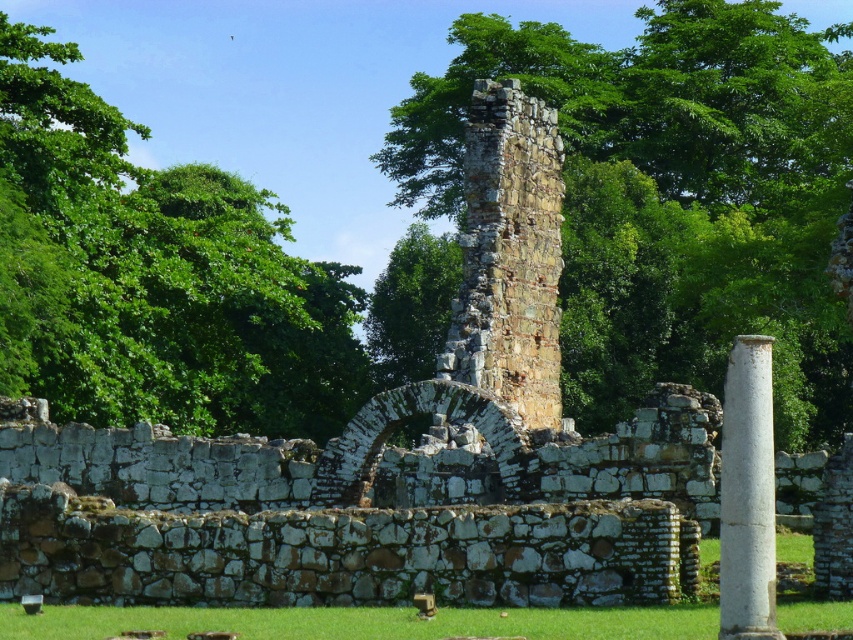
You are standing in front of the ancient stone structure and want to walk towards the green leafy tree at left and the white stone column at right. Which object will you reach first?

You will reach the green leafy tree at left first because it is closer to you than the white stone column at right, which is further away.

You are an archaeologist standing at the base of the ancient stone structure. You notice a green leafy tree at center and a green grass at lower center. How far apart are these two landmarks from each other?

The distance between the green leafy tree at center and the green grass at lower center is 262.40 feet.

You are an archaeologist standing at the entrance of the ancient stone structure. You notice a green leafy tree at center and a white stone column at right. Which object is taller?

The green leafy tree at center is taller than the white stone column at right.